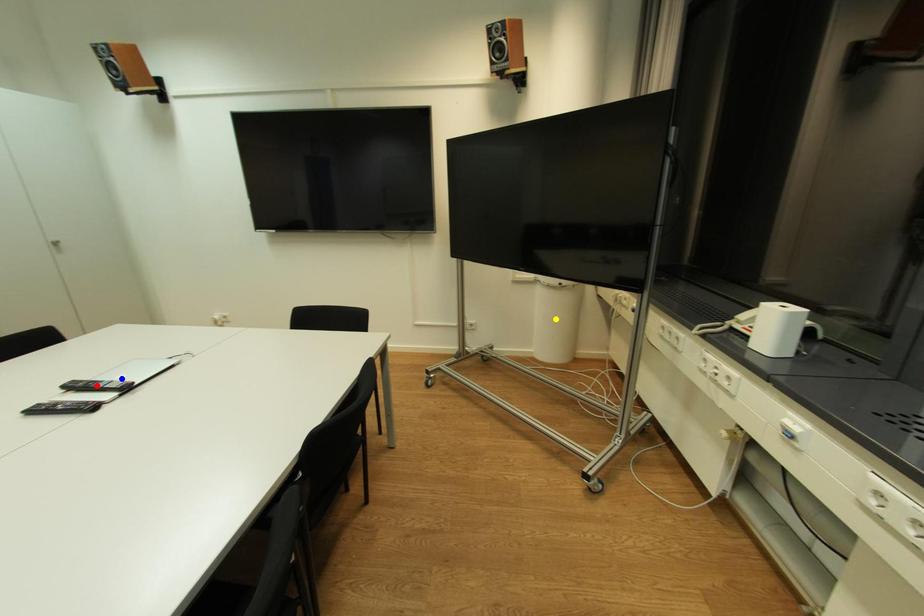
Order these from farthest to nearest:
red point, blue point, yellow point

yellow point
blue point
red point